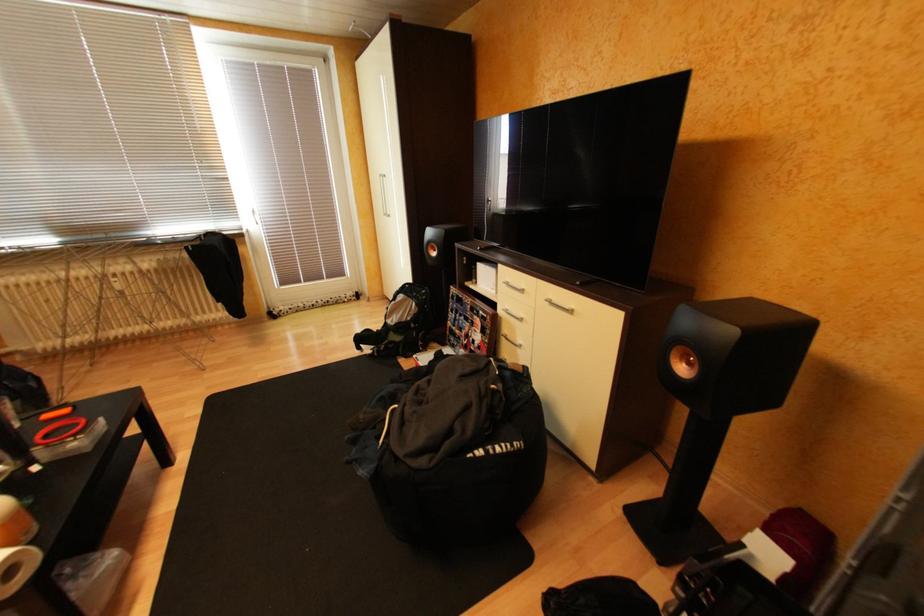
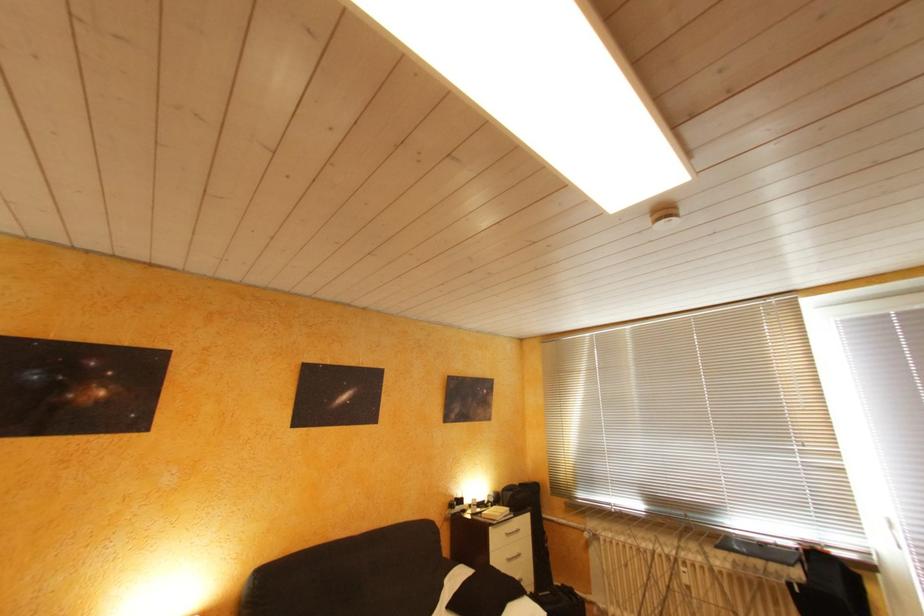
Based on the continuous images, in which direction is the camera rotating?

The camera rotated toward left-up.